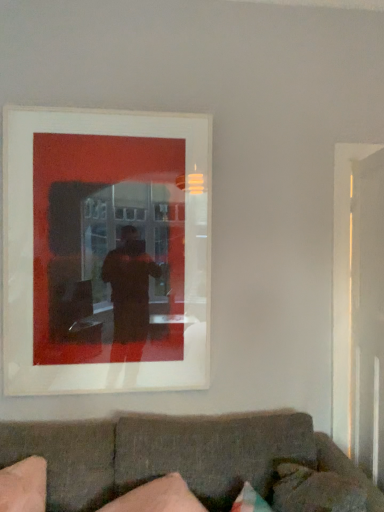
Question: From the image's perspective, is matte white picture frame at upper center above dark gray fabric couch at lower center?

Choices:
 (A) yes
 (B) no

Answer: (A)

Question: Considering the relative positions of matte white picture frame at upper center and dark gray fabric couch at lower center in the image provided, is matte white picture frame at upper center to the left of dark gray fabric couch at lower center from the viewer's perspective?

Choices:
 (A) no
 (B) yes

Answer: (B)

Question: Can you confirm if matte white picture frame at upper center is wider than dark gray fabric couch at lower center?

Choices:
 (A) yes
 (B) no

Answer: (B)

Question: Considering the relative sizes of matte white picture frame at upper center and dark gray fabric couch at lower center in the image provided, is matte white picture frame at upper center thinner than dark gray fabric couch at lower center?

Choices:
 (A) no
 (B) yes

Answer: (B)

Question: Can you confirm if matte white picture frame at upper center is shorter than dark gray fabric couch at lower center?

Choices:
 (A) yes
 (B) no

Answer: (B)

Question: Is matte white picture frame at upper center bigger than dark gray fabric couch at lower center?

Choices:
 (A) yes
 (B) no

Answer: (B)

Question: Are transparent glass door at right and matte white picture frame at upper center far apart?

Choices:
 (A) no
 (B) yes

Answer: (B)

Question: Considering the relative sizes of transparent glass door at right and matte white picture frame at upper center in the image provided, is transparent glass door at right wider than matte white picture frame at upper center?

Choices:
 (A) no
 (B) yes

Answer: (B)

Question: Can you confirm if transparent glass door at right is positioned to the right of matte white picture frame at upper center?

Choices:
 (A) yes
 (B) no

Answer: (A)

Question: Does transparent glass door at right contain matte white picture frame at upper center?

Choices:
 (A) yes
 (B) no

Answer: (B)

Question: Is transparent glass door at right with matte white picture frame at upper center?

Choices:
 (A) yes
 (B) no

Answer: (B)

Question: From the image's perspective, is transparent glass door at right above matte white picture frame at upper center?

Choices:
 (A) no
 (B) yes

Answer: (A)

Question: From the image's perspective, is matte white picture frame at upper center under pink fabric pillow at lower left, acting as the second pillow starting from the right?

Choices:
 (A) yes
 (B) no

Answer: (B)